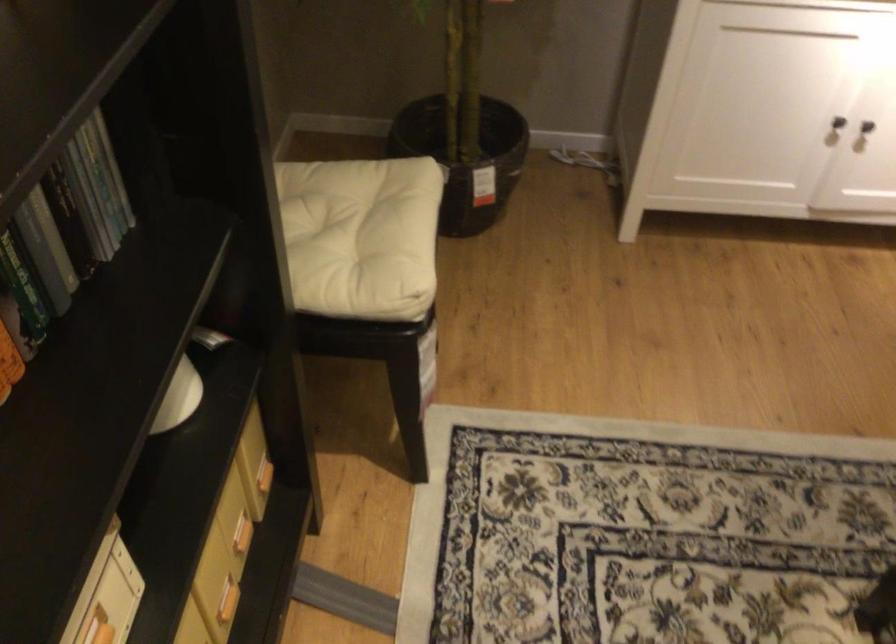
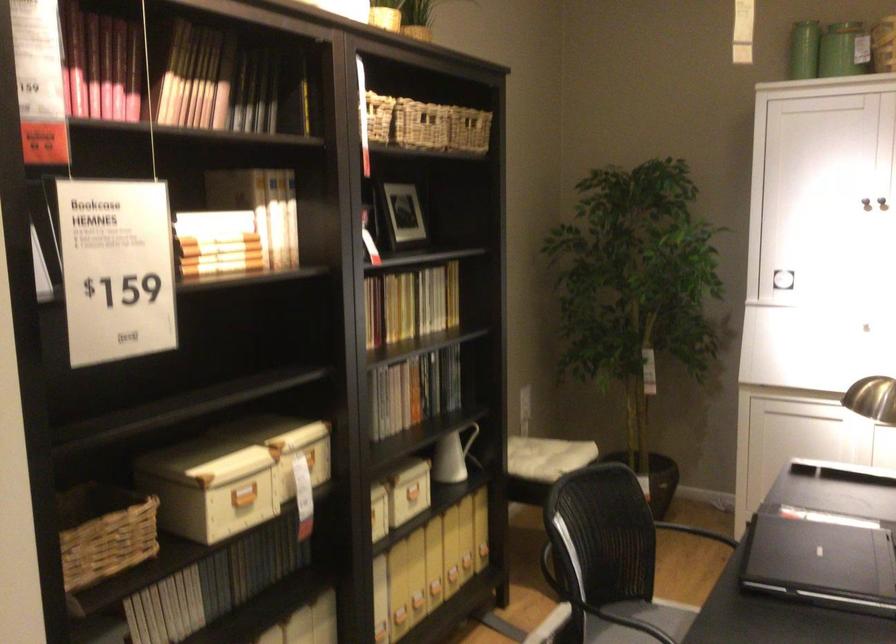
Locate, in the second image, the point that corresponds to (209,299) in the first image.

(474, 444)